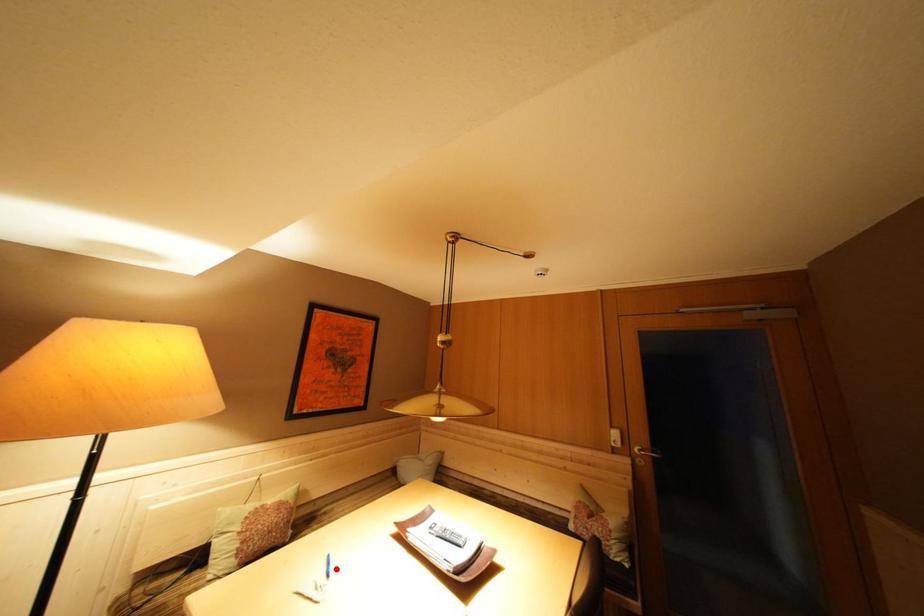
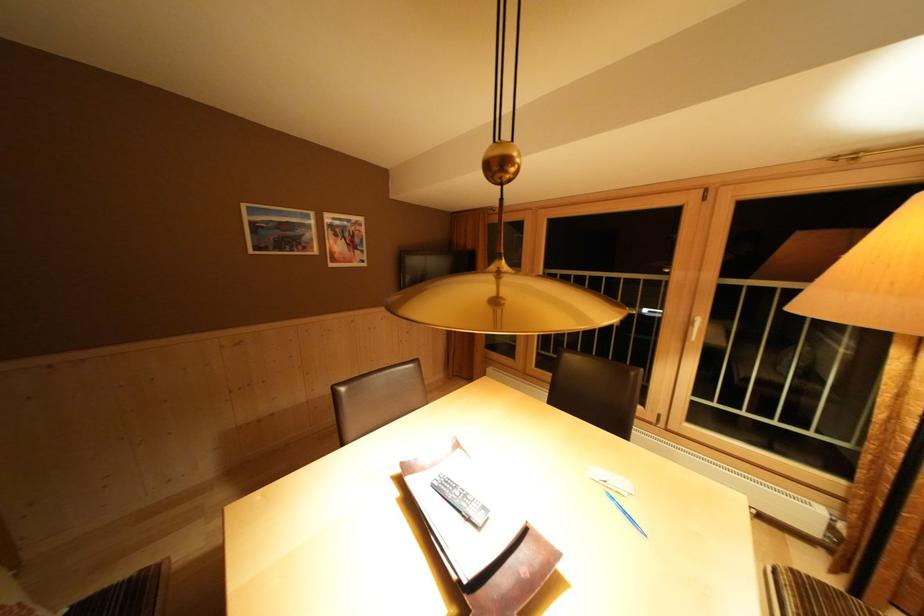
Question: I am providing you with two images of the same scene from different viewpoints. A red point is marked on the first image. Can you still see the location of the red point in image 2?

Choices:
 (A) Yes
 (B) No

Answer: (A)